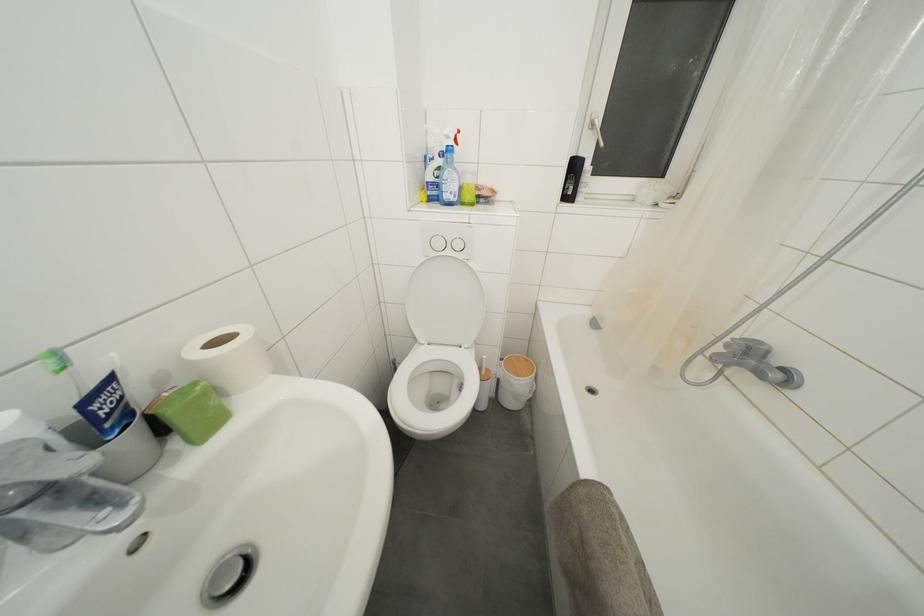
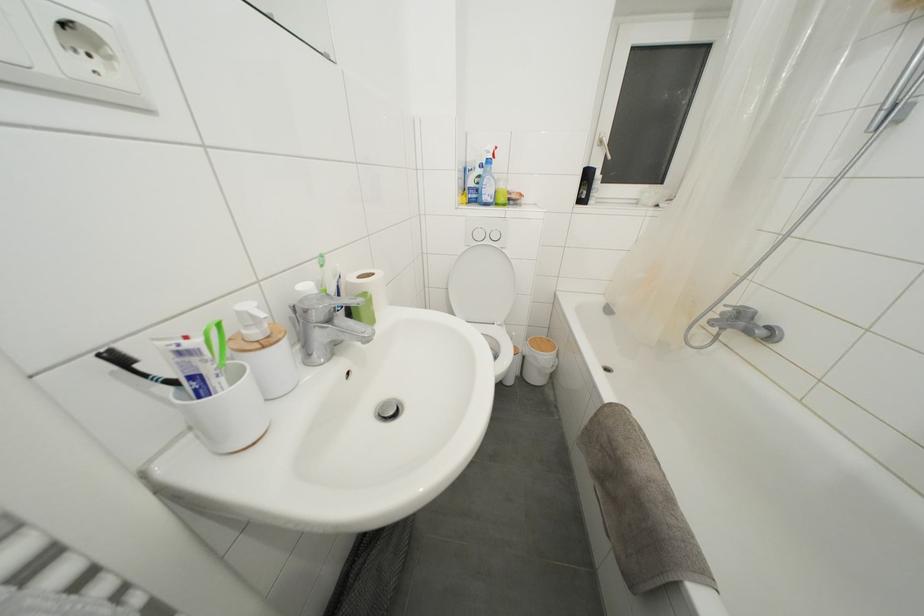
Locate, in the second image, the point that corresponds to [732,351] in the first image.

(726, 318)